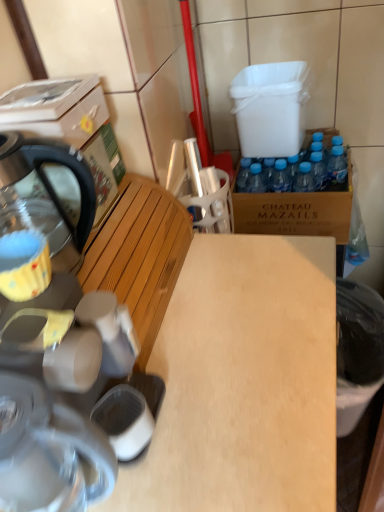
This screenshot has height=512, width=384. I want to click on vacant region above light wood desk at center (from a real-world perspective), so click(216, 326).